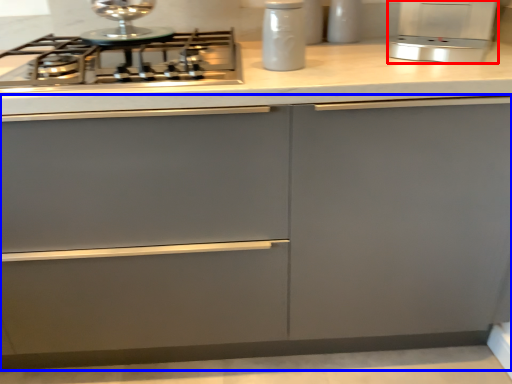
Question: Which of the following is the farthest to the observer, kitchen appliance (highlighted by a red box) or cabinetry (highlighted by a blue box)?

Choices:
 (A) kitchen appliance
 (B) cabinetry

Answer: (A)